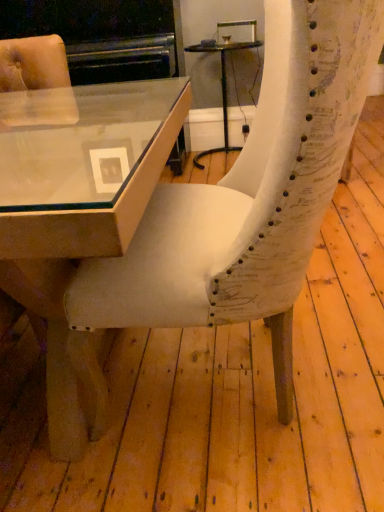
Question: Is white textured chair at center outside of matte glass table at center, arranged as the 1th table when viewed from the back?

Choices:
 (A) yes
 (B) no

Answer: (A)

Question: Is matte glass table at center, arranged as the 1th table when viewed from the back, completely or partially inside white textured chair at center?

Choices:
 (A) no
 (B) yes

Answer: (A)

Question: Is white textured chair at center at the left side of matte glass table at center, arranged as the 1th table when viewed from the back?

Choices:
 (A) no
 (B) yes

Answer: (B)

Question: Is white textured chair at center looking in the opposite direction of matte glass table at center, the second table in the front-to-back sequence?

Choices:
 (A) yes
 (B) no

Answer: (B)

Question: Can you confirm if white textured chair at center is wider than matte glass table at center, which is the 2th table in left-to-right order?

Choices:
 (A) yes
 (B) no

Answer: (A)

Question: Is the position of white textured chair at center more distant than that of matte glass table at center, the first table when ordered from right to left?

Choices:
 (A) yes
 (B) no

Answer: (B)

Question: Is white textured chair at center to the right of matte glass table at center, placed as the second table when sorted from right to left, from the viewer's perspective?

Choices:
 (A) yes
 (B) no

Answer: (A)

Question: Is white textured chair at center at the left side of matte glass table at center, which is counted as the second table, starting from the back?

Choices:
 (A) yes
 (B) no

Answer: (B)

Question: Is white textured chair at center shorter than matte glass table at center, which is the first table in front-to-back order?

Choices:
 (A) yes
 (B) no

Answer: (B)

Question: Can you confirm if white textured chair at center is taller than matte glass table at center, acting as the first table starting from the left?

Choices:
 (A) yes
 (B) no

Answer: (A)

Question: From the image's perspective, does white textured chair at center appear lower than matte glass table at center, placed as the second table when sorted from right to left?

Choices:
 (A) yes
 (B) no

Answer: (B)

Question: Does white textured chair at center have a lesser width compared to matte glass table at center, acting as the first table starting from the left?

Choices:
 (A) no
 (B) yes

Answer: (B)

Question: Is matte glass table at center, placed as the second table when sorted from right to left, thinner than matte glass table at center, the first table when ordered from right to left?

Choices:
 (A) no
 (B) yes

Answer: (A)